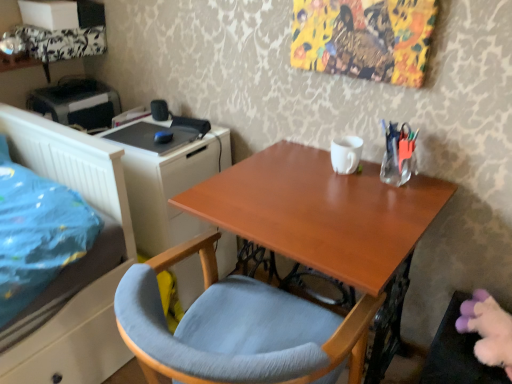
You are a GUI agent. You are given a task and a screenshot of the screen. Output one action in this format:
    pyautogui.click(x=<x>, y=<y>)
    Task: Click on the free point in front of clear glass vase at upper right
    This screenshot has width=512, height=384.
    Given the screenshot: What is the action you would take?
    pyautogui.click(x=393, y=207)